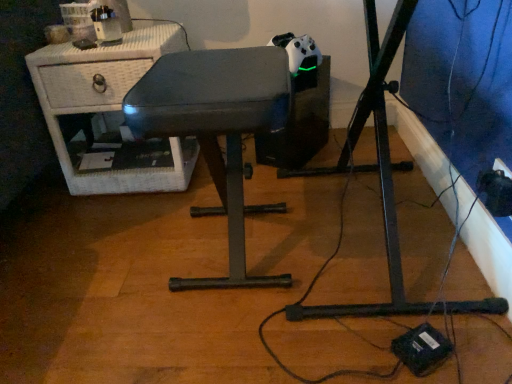
Question: In the image, is metallic gray stool at center, which is counted as the first furniture, starting from the front, on the left side or the right side of white wicker nightstand at upper left, the first furniture viewed from the back?

Choices:
 (A) left
 (B) right

Answer: (B)

Question: In the image, is metallic gray stool at center, the second furniture when ordered from back to front, positioned in front of or behind white wicker nightstand at upper left, the first furniture viewed from the back?

Choices:
 (A) front
 (B) behind

Answer: (A)

Question: From the image's perspective, is metallic gray stool at center, which is counted as the first furniture, starting from the front, positioned above or below white wicker nightstand at upper left, the second furniture when ordered from front to back?

Choices:
 (A) below
 (B) above

Answer: (A)

Question: From the image's perspective, is white wicker nightstand at upper left, which is counted as the 1th furniture, starting from the left, located above or below metallic gray stool at center, the second furniture when ordered from back to front?

Choices:
 (A) above
 (B) below

Answer: (A)

Question: Considering the positions of white wicker nightstand at upper left, which is counted as the 2th furniture, starting from the right, and metallic gray stool at center, which appears as the first furniture when viewed from the right, in the image, is white wicker nightstand at upper left, which is counted as the 2th furniture, starting from the right, taller or shorter than metallic gray stool at center, which appears as the first furniture when viewed from the right,?

Choices:
 (A) short
 (B) tall

Answer: (A)

Question: Is white wicker nightstand at upper left, which is counted as the 2th furniture, starting from the right, spatially inside metallic gray stool at center, which appears as the first furniture when viewed from the right, or outside of it?

Choices:
 (A) outside
 (B) inside

Answer: (A)

Question: In the image, is white wicker nightstand at upper left, which is counted as the 1th furniture, starting from the left, positioned in front of or behind metallic gray stool at center, the second furniture in the left-to-right sequence?

Choices:
 (A) behind
 (B) front

Answer: (A)